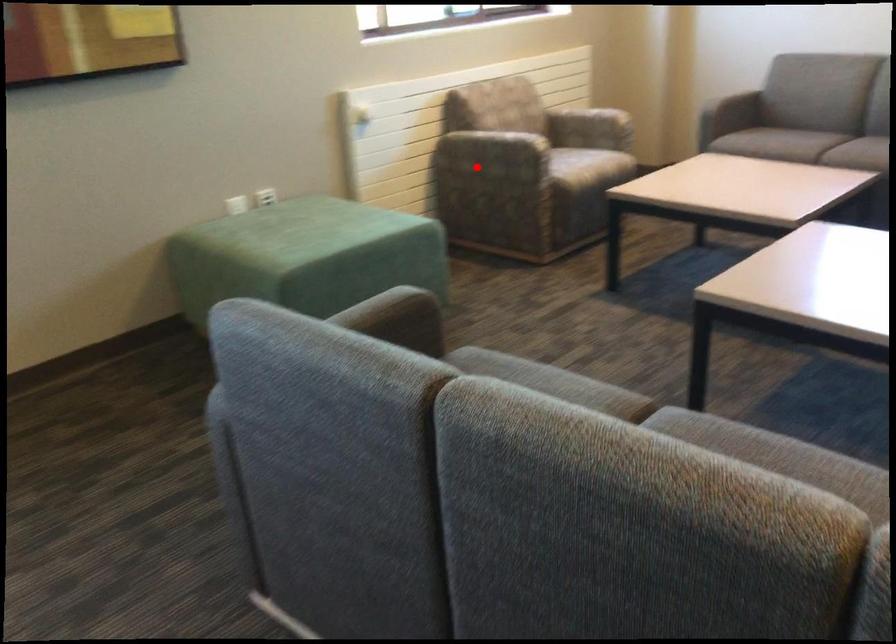
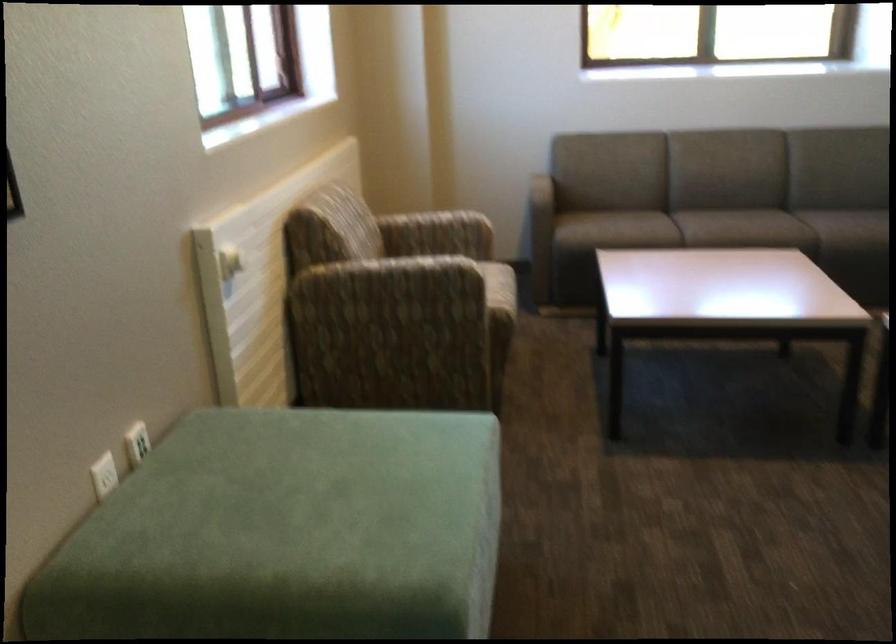
Question: I am providing you with two images of the same scene from different viewpoints. A red point is marked on the first image. At the location where the point appears in image 1, is it still visible in image 2?

Choices:
 (A) Yes
 (B) No

Answer: (A)